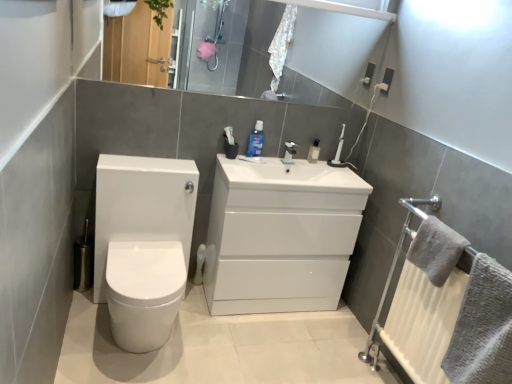
Question: In the image, is gray fluffy towel at right, placed as the second bath towel when sorted from bottom to top, on the left side or the right side of glossy white mirror at upper center?

Choices:
 (A) left
 (B) right

Answer: (B)

Question: From their relative heights in the image, would you say gray fluffy towel at right, placed as the second bath towel when sorted from bottom to top, is taller or shorter than glossy white mirror at upper center?

Choices:
 (A) short
 (B) tall

Answer: (A)

Question: Estimate the real-world distances between objects in this image. Which object is farther from the gray textured towel at right, acting as the first bath towel starting from the bottom?

Choices:
 (A) white glossy cabinet at center
 (B) transparent plastic bottle at upper center, marked as the 2th mouthwash in a left-to-right arrangement
 (C) glossy white mirror at upper center
 (D) white glossy toilet at left
 (E) matte silver faucet at upper center

Answer: (C)

Question: Which is farther from the white glossy cabinet at center?

Choices:
 (A) gray fluffy towel at right, placed as the second bath towel when sorted from bottom to top
 (B) matte silver faucet at upper center
 (C) gray textured towel at right, acting as the 2th bath towel starting from the top
 (D) glossy white mirror at upper center
 (E) blue glossy mouthwash at center, which is counted as the second mouthwash, starting from the right

Answer: (C)